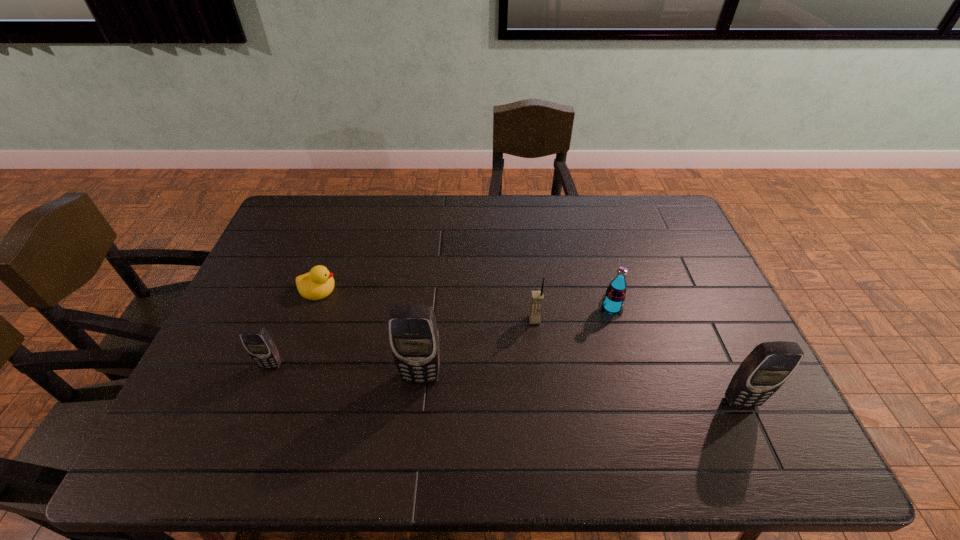
Identify the location of the shortest cellular telephone. This screenshot has width=960, height=540. (256, 340).

Identify the location of the third cellular telephone from right to left. (413, 333).

Identify the location of the nearest cellular telephone. The height and width of the screenshot is (540, 960). tap(767, 367).

You are a GUI agent. You are given a task and a screenshot of the screen. Output one action in this format:
    pyautogui.click(x=<x>, y=<y>)
    Task: Click on the third shortest cellular telephone
    Image resolution: width=960 pixels, height=540 pixels.
    Given the screenshot: What is the action you would take?
    pyautogui.click(x=767, y=367)

Identify the location of the farthest cellular telephone. (537, 297).

The image size is (960, 540). I want to click on the third cellular telephone from left to right, so click(537, 297).

Find the location of a particular element. This screenshot has height=540, width=960. duckling is located at coordinates (317, 284).

The image size is (960, 540). Find the location of `the second object from right to left`. the second object from right to left is located at coordinates (615, 294).

Identify the location of free region located on the front face of the shortest cellular telephone. This screenshot has width=960, height=540. (258, 398).

At what (x,y) coordinates should I click in order to perform the action: click on vacant region located 0.150m on the front of the farthest cellular telephone, where the keypad is located. Please return your answer as a coordinate pair (x, y). Image resolution: width=960 pixels, height=540 pixels. Looking at the image, I should click on (540, 370).